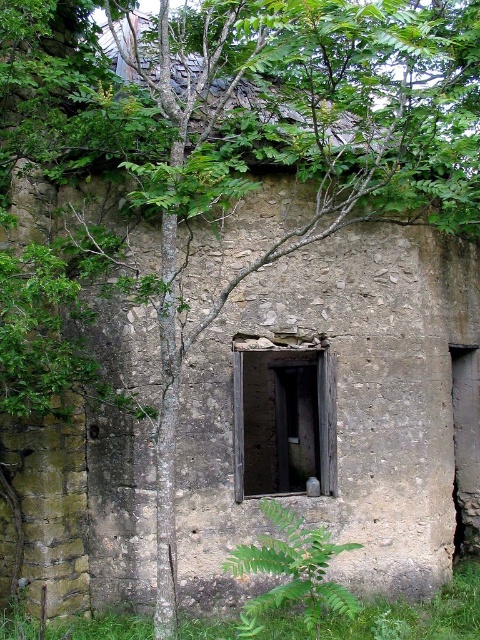
You are standing in front of the old stone structure and want to enter through the dark wood door at center. Based on the coordinates provided, is the point at (283, 419) the correct location for the door?

Yes, the point at (283, 419) corresponds to the dark wood door at center, so it is the correct location for the door.

You are an explorer standing at the entrance of the old stone structure. You see a dark wood door at center and a green leafy fern at center. Which object is closer to you?

The dark wood door at center is 9.98 feet away from the green leafy fern at center. Since both objects are at the center, their distance from you would depend on their positions relative to each other. However, the description states the distance between them is 9.98 feet, but doesn not specify which is closer to the entrance. Without additional information about their placement along the line of sight, it is impossible to determine which is nearer to the explorer.

You are standing in front of the old stone structure and want to enter through the dark wood door at center. However, there is a green leafy fern at center blocking your path. Can you step around the fern to reach the door without moving it?

The dark wood door at center is located above the green leafy fern at center, meaning the fern is positioned lower than the door. Since the fern is at the base, you can step around it to reach the door without moving it.